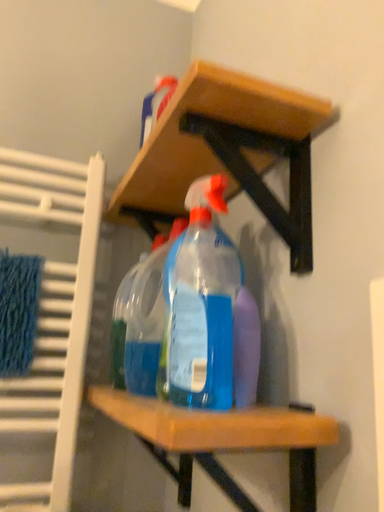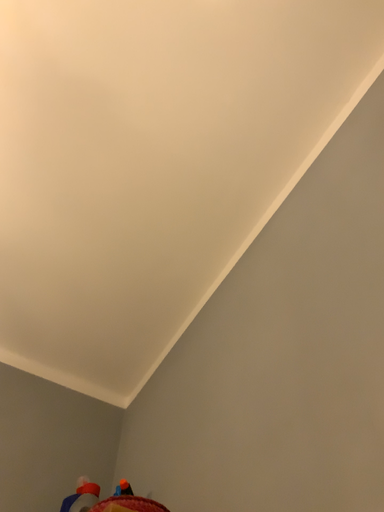
Question: Which way did the camera rotate in the video?

Choices:
 (A) rotated left
 (B) rotated right

Answer: (B)